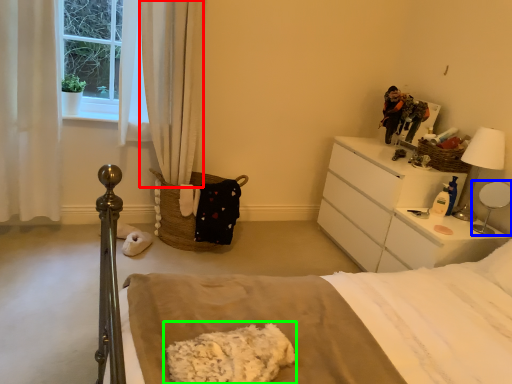
Question: Which is farther away from curtain (highlighted by a red box)? table lamp (highlighted by a blue box) or material (highlighted by a green box)?

Choices:
 (A) table lamp
 (B) material

Answer: (A)